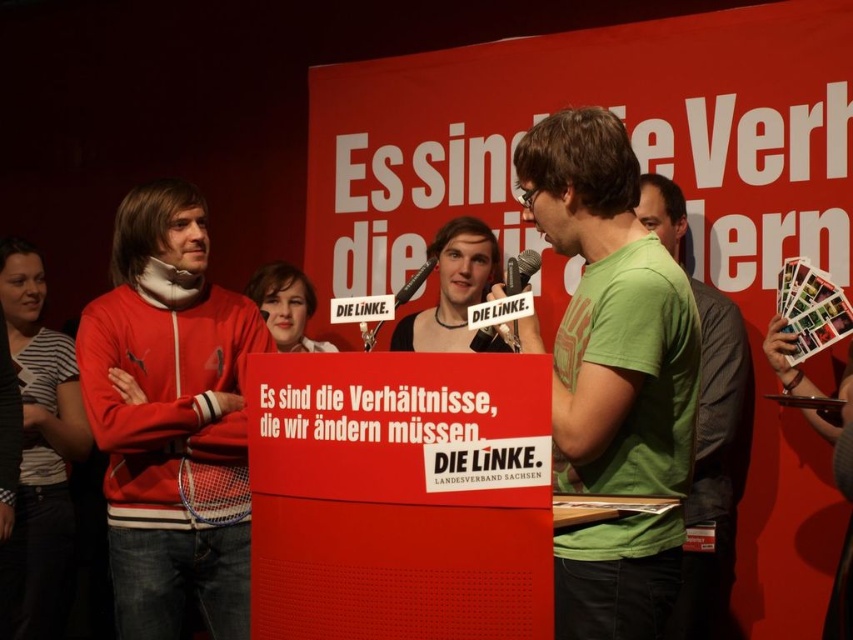
Is green matte t-shirt at right closer to the viewer compared to metallic silver microphone at center?

That is False.

Which is more to the right, green matte t-shirt at right or metallic silver microphone at center?

Positioned to the right is green matte t-shirt at right.

Identify the location of green matte t-shirt at right. (706, 428).

Is matte red sweatshirt at left closer to the viewer compared to metallic silver microphone at center?

No, it is not.

Is matte red sweatshirt at left above metallic silver microphone at center?

Incorrect, matte red sweatshirt at left is not positioned above metallic silver microphone at center.

Locate an element on the screen. This screenshot has width=853, height=640. matte red sweatshirt at left is located at coordinates (167, 413).

Find the location of a particular element. The image size is (853, 640). matte red sweatshirt at left is located at coordinates (167, 413).

Who is positioned more to the left, striped fabric shirt at left or black metallic microphone at center?

striped fabric shirt at left

Based on the photo, is striped fabric shirt at left shorter than black metallic microphone at center?

No.

At what (x,y) coordinates should I click in order to perform the action: click on striped fabric shirt at left. Please return your answer as a coordinate pair (x, y). The image size is (853, 640). Looking at the image, I should click on (39, 456).